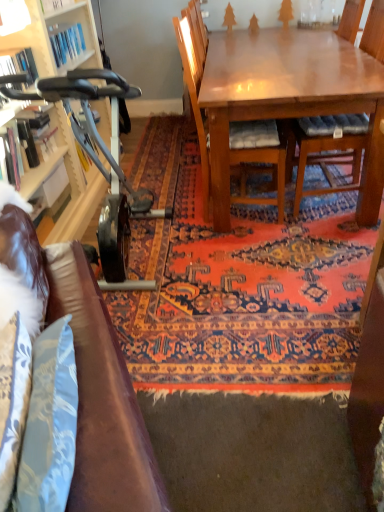
Question: From the image's perspective, is carpeted rug at center above or below wooden bookshelf at left?

Choices:
 (A) above
 (B) below

Answer: (B)

Question: Considering their positions, is carpeted rug at center located in front of or behind wooden bookshelf at left?

Choices:
 (A) behind
 (B) front

Answer: (B)

Question: Considering the real-world distances, which object is closest to the shiny brown table at upper right?

Choices:
 (A) matte white cabinet at left
 (B) wooden chair with cushion at center, the 2th chair in the left-to-right sequence
 (C) wooden bookshelf at left
 (D) brown leather couch at lower left
 (E) wooden chair at center, the first chair when ordered from left to right

Answer: (E)

Question: Which is farther from the wooden chair with cushion at center, the 2th chair in the left-to-right sequence?

Choices:
 (A) brown leather couch at lower left
 (B) wooden chair at center, acting as the second chair starting from the right
 (C) shiny brown table at upper right
 (D) metallic gray exercise bike at left
 (E) wooden bookshelf at left

Answer: (A)